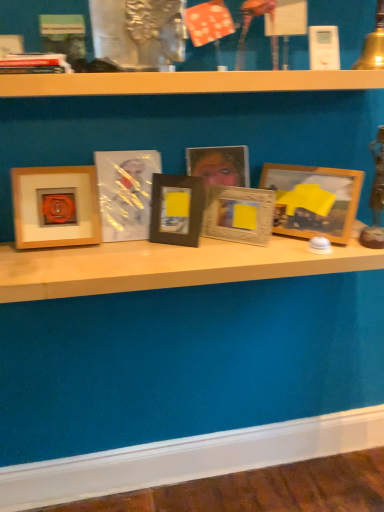
At what (x,y) coordinates should I click in order to perform the action: click on free spot above wooden shelf at center (from a real-world perspective). Please return your answer as a coordinate pair (x, y). The height and width of the screenshot is (512, 384). Looking at the image, I should click on (173, 250).